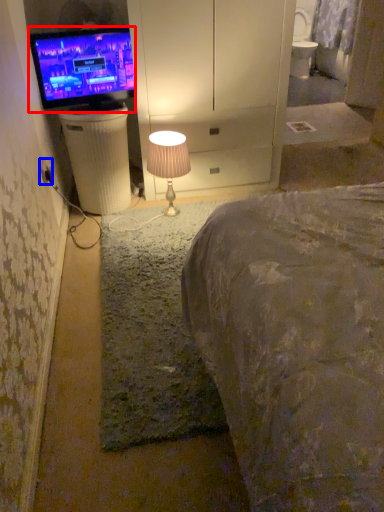
Question: Which object is closer to the camera taking this photo, television (highlighted by a red box) or electric outlet (highlighted by a blue box)?

Choices:
 (A) television
 (B) electric outlet

Answer: (B)